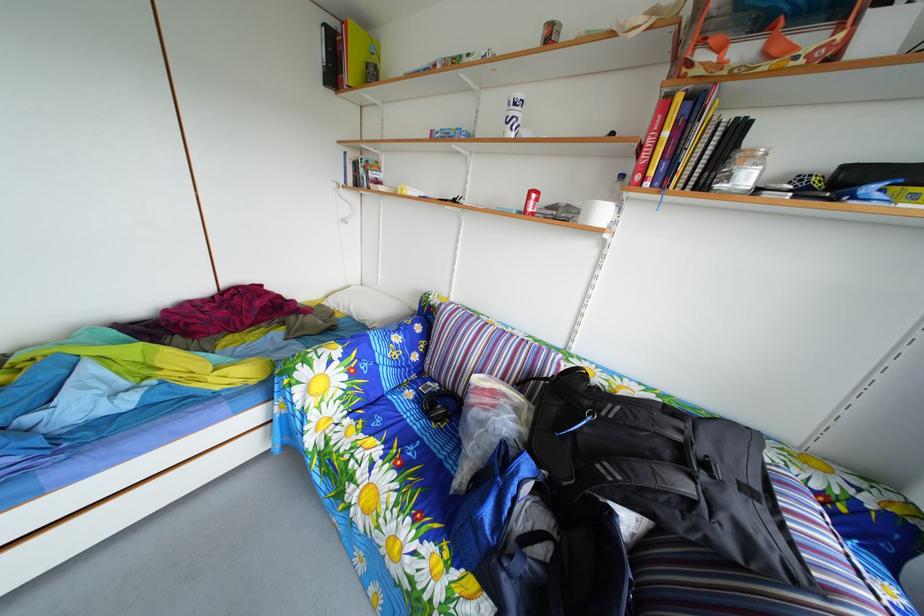
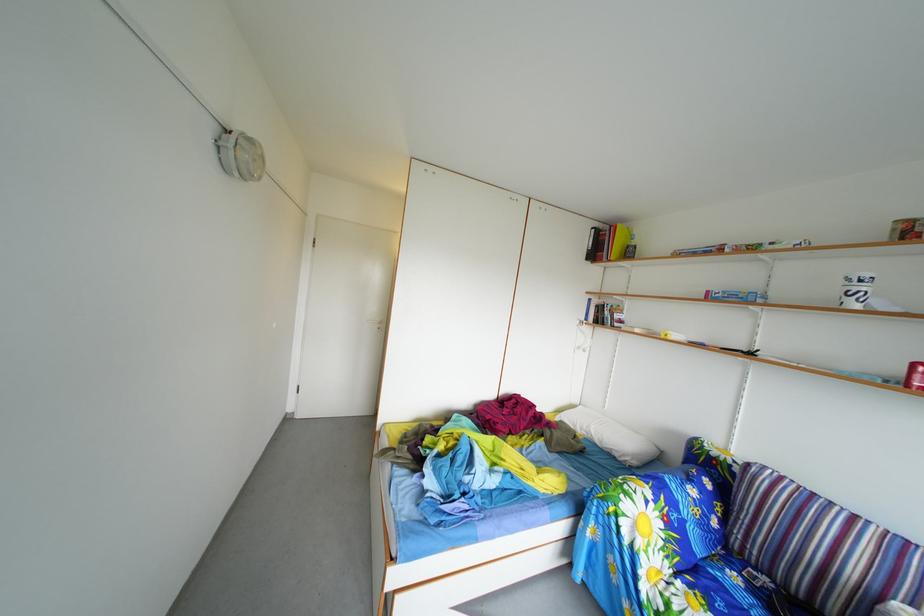
Find the pixel in the second image that matches pixel 342 30 in the first image.

(608, 233)